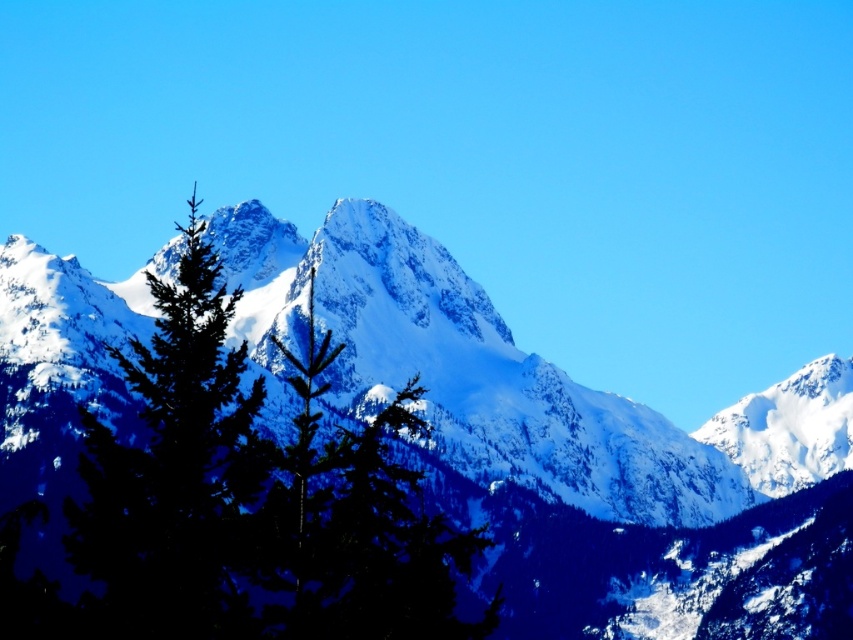
Can you confirm if snowy peak at center is thinner than green matte tree at center?

No, snowy peak at center is not thinner than green matte tree at center.

Who is shorter, snowy peak at center or green matte tree at center?

green matte tree at center is shorter.

This screenshot has height=640, width=853. What do you see at coordinates (380, 458) in the screenshot?
I see `snowy peak at center` at bounding box center [380, 458].

You are a GUI agent. You are given a task and a screenshot of the screen. Output one action in this format:
    pyautogui.click(x=<x>, y=<y>)
    Task: Click on the snowy peak at center
    
    Given the screenshot: What is the action you would take?
    pyautogui.click(x=380, y=458)